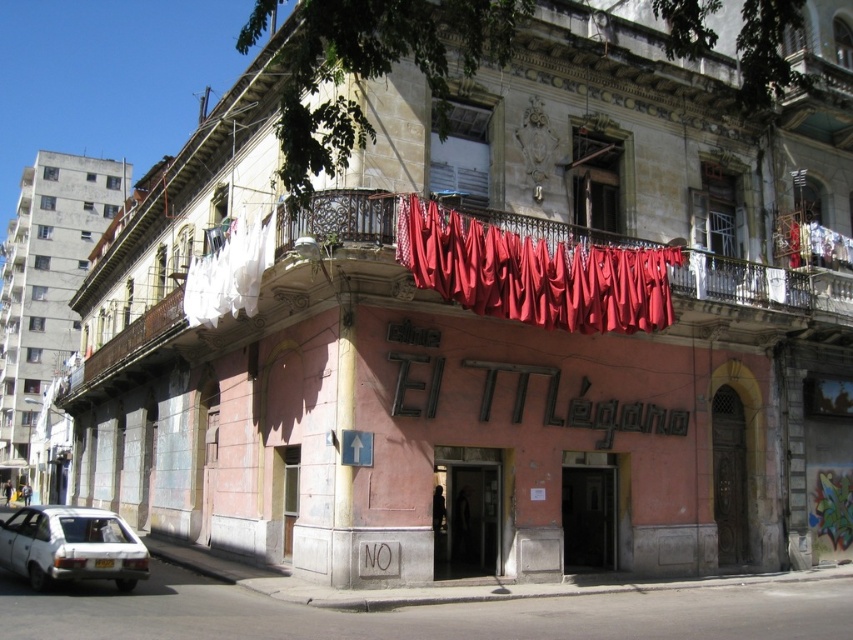
You are standing in front of the El Tigeano building and want to take a photo of the point at coordinate (436, 243). Your camera has a maximum focus range of 50 meters. Will the camera be able to focus on that point?

The point at coordinate (436, 243) is 48.64 meters away from the viewer. Since the camera can focus up to 50 meters, it will be able to focus on the point as it is within the maximum range.

You are a delivery driver who needs to park your white matte car at lower left near the building entrance. However, there is a red fabric at upper center hanging above the entrance. Is there enough space for your car to pass underneath the fabric without touching it?

The red fabric at upper center is larger in size compared to the white matte car at lower left. Since the fabric is larger, it likely extends further out, creating enough vertical clearance for the car to pass underneath without touching it.

You are standing in front of the building named El Tigeano and want to locate the point at coordinates (534, 273). Based on the scene description, where would this point be located?

The point at coordinates (534, 273) is on the red fabric at upper center, which is part of the balcony adorned with red garments on the upper level of the building named El Tigeano.